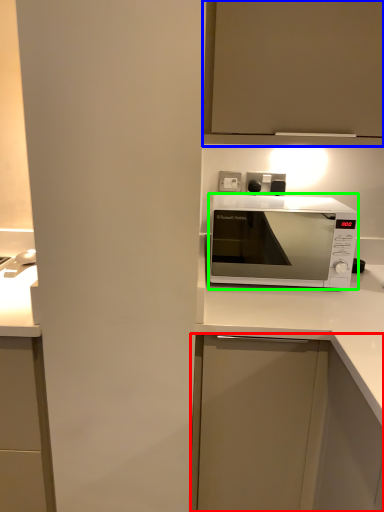
Question: Considering the real-world distances, which object is farthest from cabinetry (highlighted by a red box)? cabinetry (highlighted by a blue box) or microwave oven (highlighted by a green box)?

Choices:
 (A) cabinetry
 (B) microwave oven

Answer: (B)